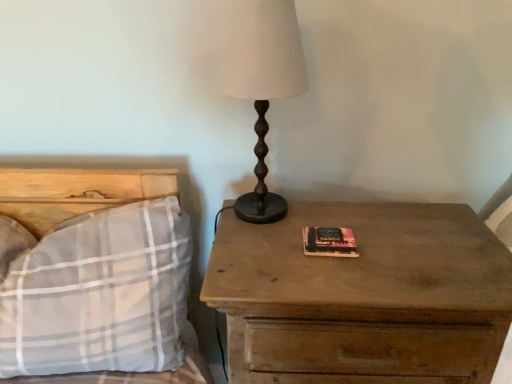
Where is `vacant area located to the right-hand side of matte brown table lamp at center`? The image size is (512, 384). vacant area located to the right-hand side of matte brown table lamp at center is located at coordinates pyautogui.click(x=354, y=230).